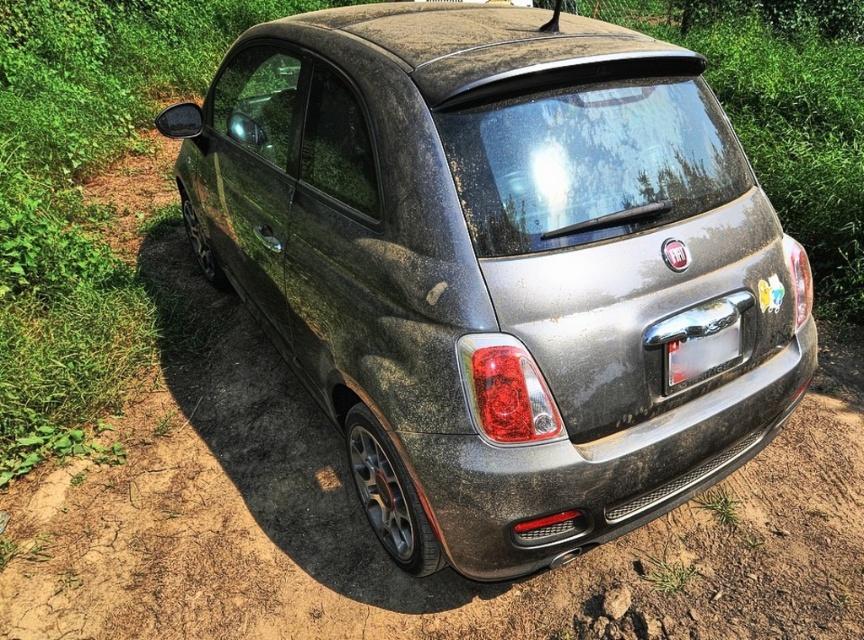
What do you see at coordinates (496, 266) in the screenshot?
I see `dusty metallic car at center` at bounding box center [496, 266].

Can you confirm if dusty metallic car at center is positioned to the left of transparent plastic license plate at center?

Yes, dusty metallic car at center is to the left of transparent plastic license plate at center.

Where is `dusty metallic car at center`? dusty metallic car at center is located at coordinates (496, 266).